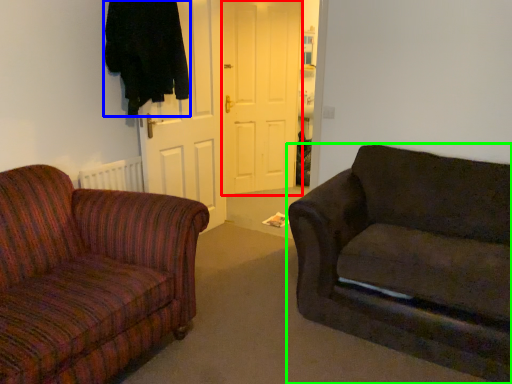
Question: Considering the real-world distances, which object is closest to door (highlighted by a red box)? clothing (highlighted by a blue box) or studio couch (highlighted by a green box).

Choices:
 (A) clothing
 (B) studio couch

Answer: (A)